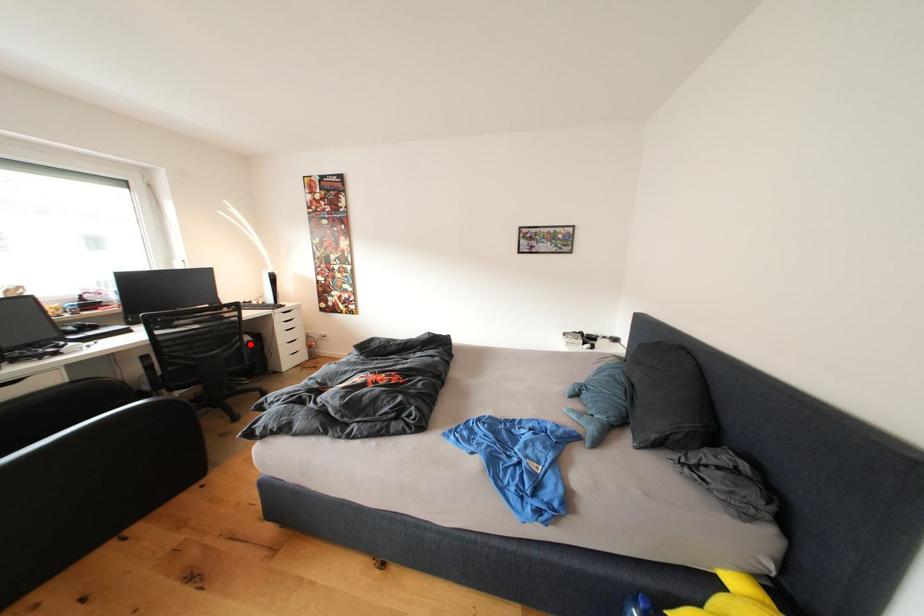
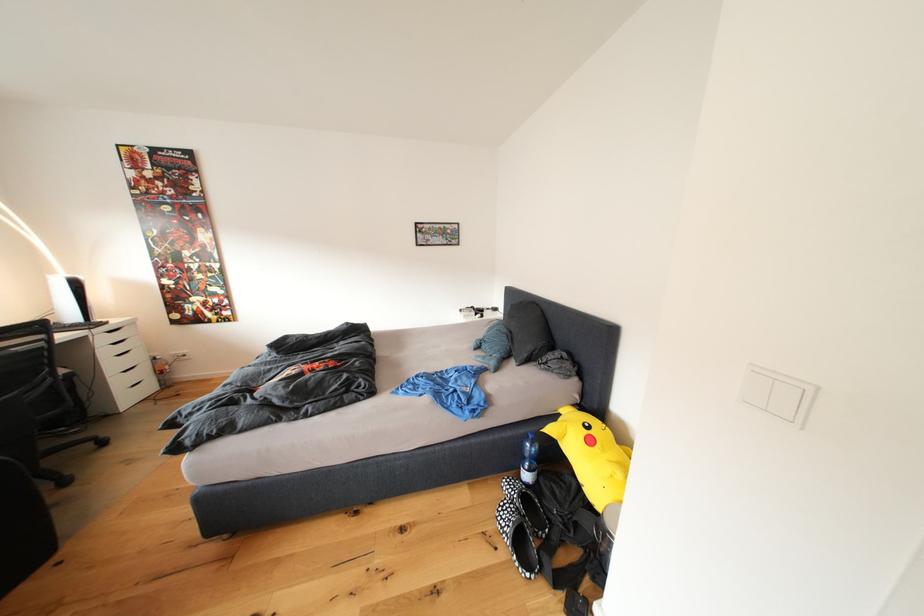
Question: I am providing you with two images of the same scene from different viewpoints. Given a red point in image1, look at the same physical point in image2. Is it:

Choices:
 (A) Closer to the viewpoint
 (B) Farther from the viewpoint

Answer: (B)